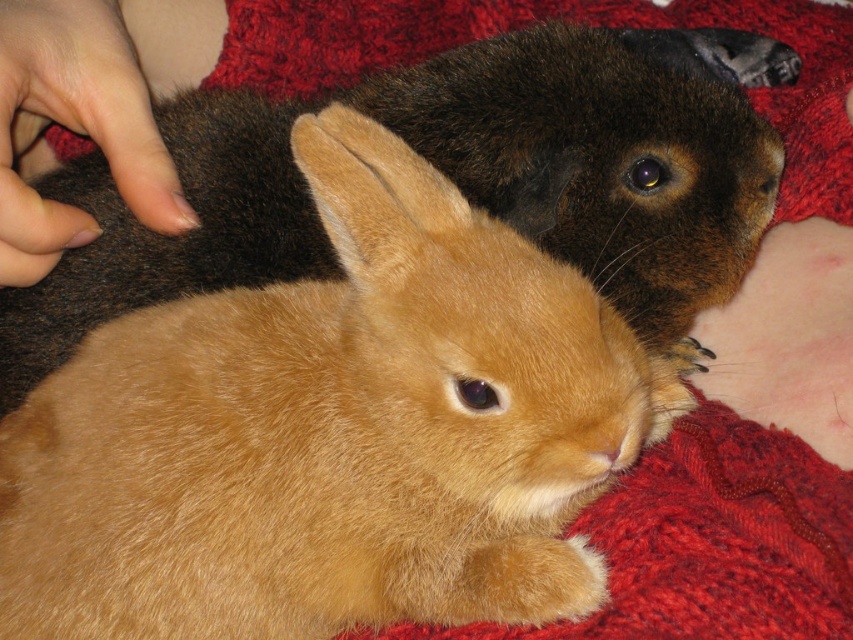
You are a photographer trying to capture a closeup of the golden fur rabbit at center. However, there is a nail polish at upper left in the frame. Since you want the rabbit to be the main focus, which object should you move and why?

You should move the nail polish at upper left because the golden fur rabbit at center is bigger and should be the main focus of the photo.

Looking at this image, you are holding a small toy and want to place it between the golden fur rabbit at center and the nail polish at upper left. Can you place it in front of both objects?

The nail polish at upper left is behind the golden fur rabbit at center, so placing the toy in front of both would require positioning it in front of the golden fur rabbit at center, as the nail polish is already behind it.

You are a photographer trying to capture a closeup shot of both rabbits. Your camera can only focus on objects within a 6 inch range. Given that the soft brown fur rabbit at center and golden fur rabbit at center are 7.50 inches apart, will you be able to get both rabbits in focus?

The soft brown fur rabbit at center and golden fur rabbit at center are 7.50 inches apart, which exceeds the camera focus range of 6 inches. Therefore, you cannot get both rabbits in focus with the current camera settings.